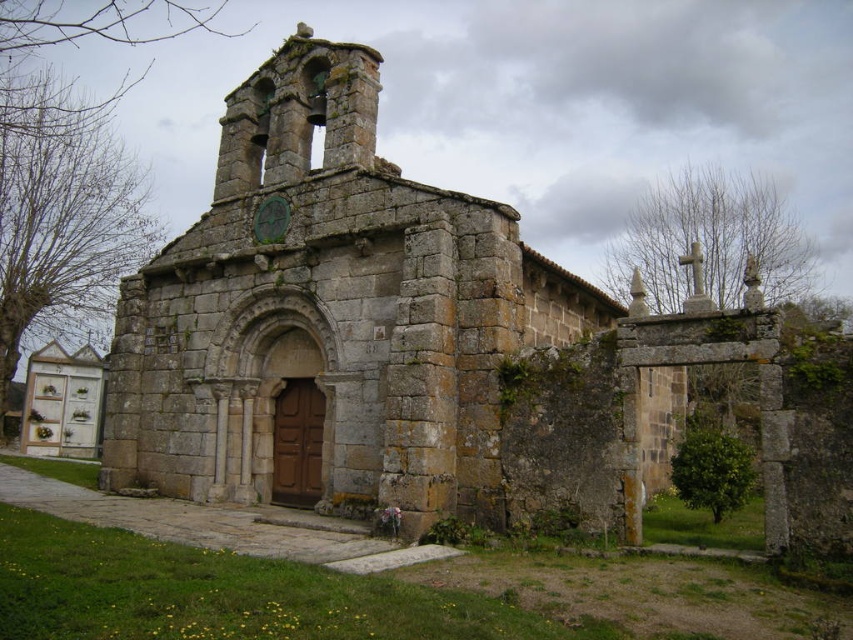
You are a maintenance worker who needs to reach the green stone clock at upper center from the stone chapel at center. Given that your ladder can extend up to 12 meters, will it be sufficient to reach the clock?

The distance between the stone chapel at center and the green stone clock at upper center is 11.58 meters, so the ladder can extend up to 12 meters, which is sufficient to reach the clock.

You are standing in front of a historic stone church with a bell tower. There is a point marked at coordinates (328, 317). Based on the scene description, what does this point most likely represent?

The point at coordinates (328, 317) most likely represents the stone chapel at center as described in the scene.